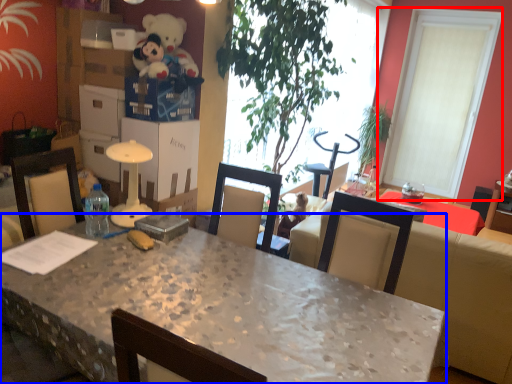
Question: Among these objects, which one is nearest to the camera, window (highlighted by a red box) or desk (highlighted by a blue box)?

Choices:
 (A) window
 (B) desk

Answer: (B)